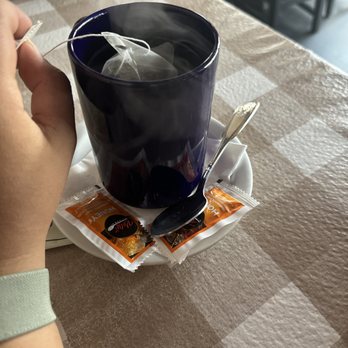
At what (x,y) coordinates should I click in order to perform the action: click on table mat. Please return your answer as a coordinate pair (x, y). This screenshot has width=348, height=348. Looking at the image, I should click on (285, 288).